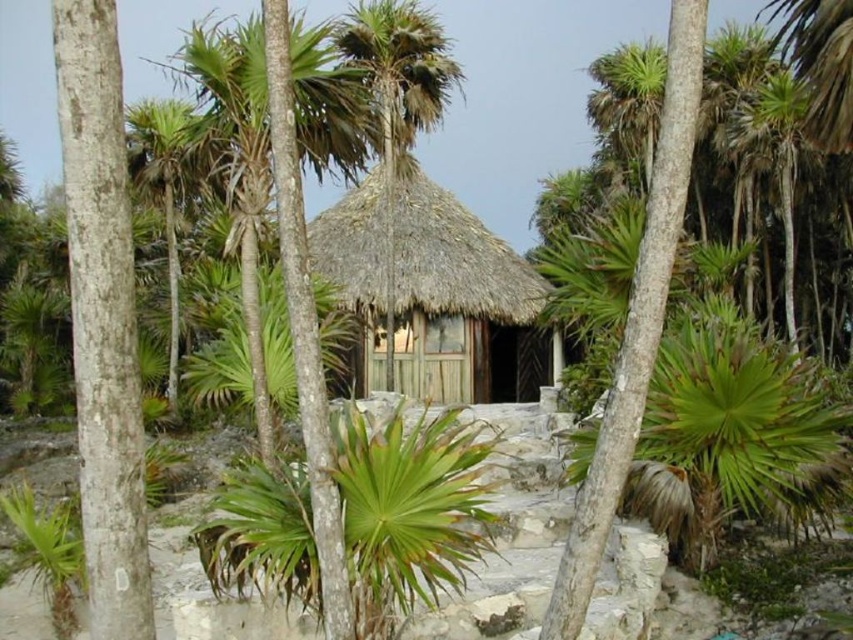
Is white smooth tree trunk at left above green leafy palm tree at upper left?

No, white smooth tree trunk at left is not above green leafy palm tree at upper left.

Which of these two, white smooth tree trunk at left or green leafy palm tree at upper left, stands taller?

green leafy palm tree at upper left is taller.

Locate an element on the screen. This screenshot has height=640, width=853. white smooth tree trunk at left is located at coordinates 102,317.

Who is more forward, (387, 65) or (173, 104)?

Point (387, 65) is more forward.

Which of these two, green leafy palm tree at center or green leafy palm tree at upper left, stands taller?

Standing taller between the two is green leafy palm tree at upper left.

Which is behind, point (386, 372) or point (175, 99)?

Point (386, 372)

The height and width of the screenshot is (640, 853). In order to click on green leafy palm tree at center in this screenshot , I will do `click(398, 100)`.

How far apart are thatched wood hut at center and green leafy palm tree at upper left?

They are 5.74 meters apart.

Is the position of thatched wood hut at center less distant than that of green leafy palm tree at upper left?

No, it is behind green leafy palm tree at upper left.

You are a GUI agent. You are given a task and a screenshot of the screen. Output one action in this format:
    pyautogui.click(x=<x>, y=<y>)
    Task: Click on the thatched wood hut at center
    The height and width of the screenshot is (640, 853).
    Given the screenshot: What is the action you would take?
    pyautogui.click(x=463, y=305)

In order to click on thatched wood hut at center in this screenshot , I will do coord(463,305).